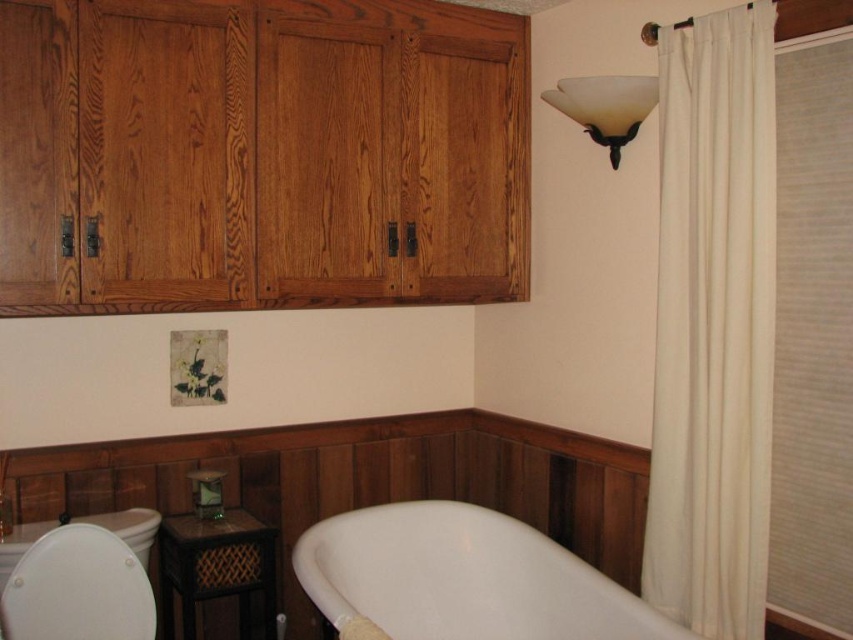
Question: Can you confirm if white fabric shower curtain at right is positioned to the right of white glossy toilet bowl at lower left?

Choices:
 (A) yes
 (B) no

Answer: (A)

Question: Which point is closer to the camera taking this photo?

Choices:
 (A) (728, 560)
 (B) (476, 588)
 (C) (50, 627)

Answer: (C)

Question: Which point is farther from the camera taking this photo?

Choices:
 (A) (648, 33)
 (B) (25, 580)

Answer: (A)

Question: Which of the following is the farthest from the observer?

Choices:
 (A) white glossy bathtub at lower center
 (B) white fabric shower curtain at right
 (C) white matte shower curtain at upper right

Answer: (C)

Question: Does white glossy toilet bowl at lower left appear over white matte shower curtain at upper right?

Choices:
 (A) no
 (B) yes

Answer: (A)

Question: Is white glossy bathtub at lower center above white frosted glass sconce at upper right?

Choices:
 (A) no
 (B) yes

Answer: (A)